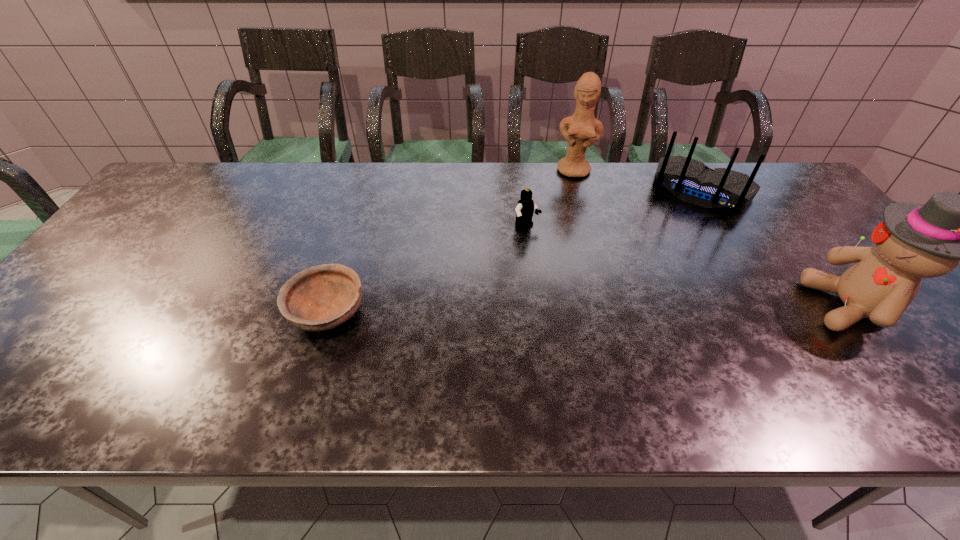
I want to click on vacant space at the left edge, so click(x=125, y=275).

In the image, there is a desktop. What are the coordinates of `vacant space at the right edge` in the screenshot? It's located at coord(820,217).

In the image, there is a desktop. Where is `vacant space at the far left corner`? This screenshot has height=540, width=960. vacant space at the far left corner is located at coordinates (x=212, y=168).

Find the location of a particular element. The height and width of the screenshot is (540, 960). vacant space at the far right corner is located at coordinates (x=793, y=204).

Identify the location of free spot between the third object from right to left and the rag_doll. (712, 238).

Where is `free space that is in between the third shortest object and the third nearest object`? free space that is in between the third shortest object and the third nearest object is located at coordinates (614, 210).

Image resolution: width=960 pixels, height=540 pixels. Identify the location of vacant area that lies between the Lego and the rag_doll. (688, 267).

The image size is (960, 540). Find the location of `blank region between the router and the rag_doll`. blank region between the router and the rag_doll is located at coordinates (776, 248).

Find the location of a particular element. Image resolution: width=960 pixels, height=540 pixels. free point between the figurine and the router is located at coordinates (638, 181).

I want to click on free space between the router and the bowl, so click(515, 252).